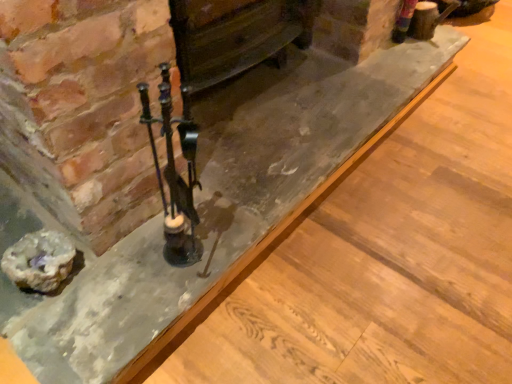
At what (x,y) coordinates should I click in order to perform the action: click on free space to the right of gray marble at lower left. Please return your answer as a coordinate pair (x, y). This screenshot has height=384, width=512. Looking at the image, I should click on pyautogui.click(x=117, y=278).